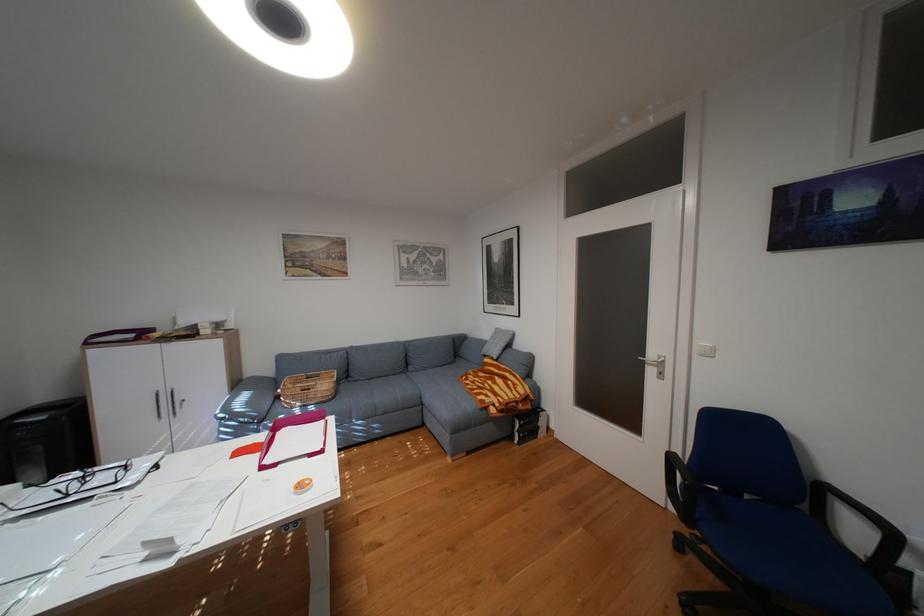
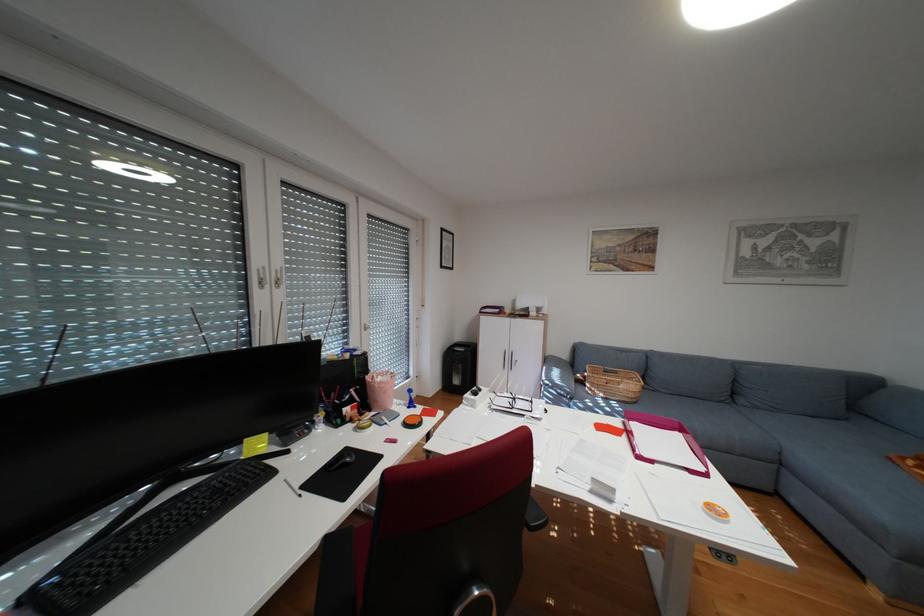
Question: The camera is either moving clockwise (left) or counter-clockwise (right) around the object. The first image is from the beginning of the video and the second image is from the end. Is the camera moving left or right when shooting the video?

Choices:
 (A) Left
 (B) Right

Answer: (B)